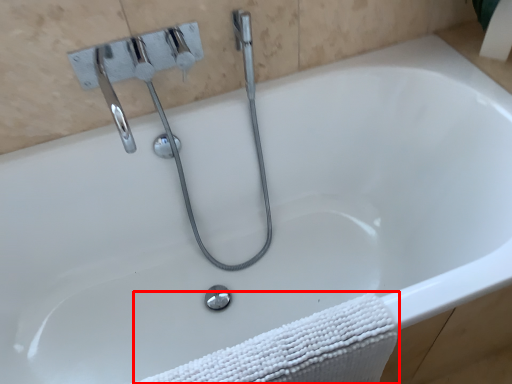
Question: From the image's perspective, considering the relative positions of bath towel (annotated by the red box) and plumbing fixture in the image provided, where is bath towel (annotated by the red box) located with respect to the staircase?

Choices:
 (A) below
 (B) above

Answer: (A)